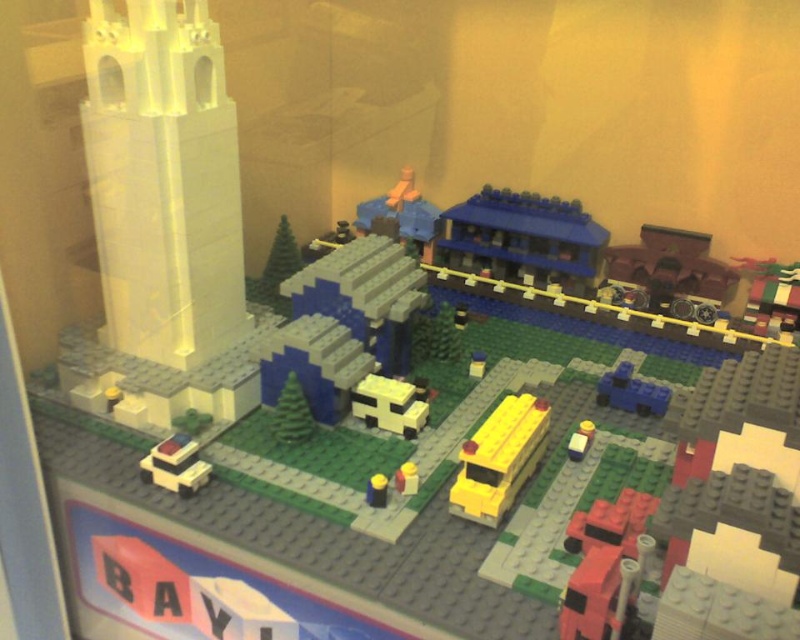
Is point (409, 413) closer to viewer compared to point (578, 444)?

No, (409, 413) is behind (578, 444).

How much distance is there between yellow matte bench at center and yellow plastic bus at center?

The distance of yellow matte bench at center from yellow plastic bus at center is 25.46 centimeters.

Where is `yellow matte bench at center`? The width and height of the screenshot is (800, 640). yellow matte bench at center is located at coordinates (389, 404).

Where is `metallic silver car at center right`? Image resolution: width=800 pixels, height=640 pixels. metallic silver car at center right is located at coordinates (672, 268).

Which is below, metallic silver car at center right or yellow plastic bus at center?

yellow plastic bus at center is lower down.

You are a GUI agent. You are given a task and a screenshot of the screen. Output one action in this format:
    pyautogui.click(x=<x>, y=<y>)
    Task: Click on the metallic silver car at center right
    
    Given the screenshot: What is the action you would take?
    pyautogui.click(x=672, y=268)

Between white plastic tower at left and yellow plastic bus at center, which one is positioned lower?

yellow plastic bus at center is below.

Does white plastic tower at left have a lesser width compared to yellow plastic bus at center?

No.

Locate an element on the screen. white plastic tower at left is located at coordinates (164, 179).